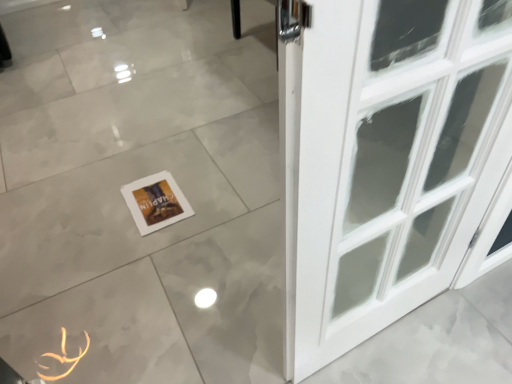
Question: From a real-world perspective, relative to white glossy tile at center, is orange rubber band at lower left vertically above or below?

Choices:
 (A) above
 (B) below

Answer: (A)

Question: From the image's perspective, is orange rubber band at lower left positioned above or below white glossy tile at center?

Choices:
 (A) above
 (B) below

Answer: (B)

Question: Estimate the real-world distances between objects in this image. Which object is farther from the orange rubber band at lower left?

Choices:
 (A) white paper at lower center
 (B) white glossy tile at center

Answer: (B)

Question: Which object is positioned closest to the orange rubber band at lower left?

Choices:
 (A) white paper at lower center
 (B) white glossy tile at center

Answer: (A)